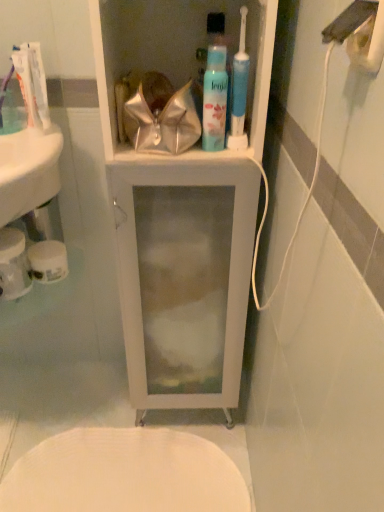
Question: Is white glossy toothpaste at upper left, which appears as the 1th toothpaste when viewed from the back, facing towards white glossy cabinet at center?

Choices:
 (A) no
 (B) yes

Answer: (A)

Question: Considering the relative positions of white glossy toothpaste at upper left, which appears as the 1th toothpaste when viewed from the back, and white glossy cabinet at center in the image provided, is white glossy toothpaste at upper left, which appears as the 1th toothpaste when viewed from the back, to the right of white glossy cabinet at center from the viewer's perspective?

Choices:
 (A) no
 (B) yes

Answer: (A)

Question: Is white glossy toothpaste at upper left, placed as the 2th toothpaste when sorted from front to back, closer to camera compared to white glossy cabinet at center?

Choices:
 (A) no
 (B) yes

Answer: (A)

Question: Does white glossy toothpaste at upper left, which appears as the 1th toothpaste when viewed from the back, have a greater height compared to white glossy cabinet at center?

Choices:
 (A) yes
 (B) no

Answer: (B)

Question: From the image's perspective, does white glossy toothpaste at upper left, placed as the 2th toothpaste when sorted from front to back, appear lower than white glossy cabinet at center?

Choices:
 (A) no
 (B) yes

Answer: (A)

Question: Does white glossy toothpaste at upper left, placed as the 2th toothpaste when sorted from front to back, have a lesser width compared to white glossy cabinet at center?

Choices:
 (A) no
 (B) yes

Answer: (B)

Question: Is translucent plastic toothpaste at upper left, which appears as the 2th toothpaste when viewed from the back, next to white matte toilet paper at lower left, which appears as the 2th toilet paper when viewed from the left?

Choices:
 (A) yes
 (B) no

Answer: (B)

Question: Considering the relative sizes of translucent plastic toothpaste at upper left, marked as the first toothpaste in a front-to-back arrangement, and white matte toilet paper at lower left, which is the first toilet paper in right-to-left order, in the image provided, is translucent plastic toothpaste at upper left, marked as the first toothpaste in a front-to-back arrangement, wider than white matte toilet paper at lower left, which is the first toilet paper in right-to-left order,?

Choices:
 (A) yes
 (B) no

Answer: (B)

Question: Does translucent plastic toothpaste at upper left, marked as the first toothpaste in a front-to-back arrangement, turn towards white matte toilet paper at lower left, which is the first toilet paper in right-to-left order?

Choices:
 (A) no
 (B) yes

Answer: (A)

Question: From the image's perspective, would you say translucent plastic toothpaste at upper left, which appears as the 2th toothpaste when viewed from the back, is shown under white matte toilet paper at lower left, which appears as the 2th toilet paper when viewed from the left?

Choices:
 (A) no
 (B) yes

Answer: (A)

Question: From a real-world perspective, does translucent plastic toothpaste at upper left, marked as the first toothpaste in a front-to-back arrangement, sit lower than white matte toilet paper at lower left, which appears as the 2th toilet paper when viewed from the left?

Choices:
 (A) no
 (B) yes

Answer: (A)

Question: From a real-world perspective, does translucent plastic toothpaste at upper left, marked as the first toothpaste in a front-to-back arrangement, stand above white matte toilet paper at lower left, which appears as the 2th toilet paper when viewed from the left?

Choices:
 (A) yes
 (B) no

Answer: (A)

Question: From a real-world perspective, is white textured toilet at lower center located beneath translucent plastic toothpaste at upper left, which appears as the 2th toothpaste when viewed from the back?

Choices:
 (A) no
 (B) yes

Answer: (B)